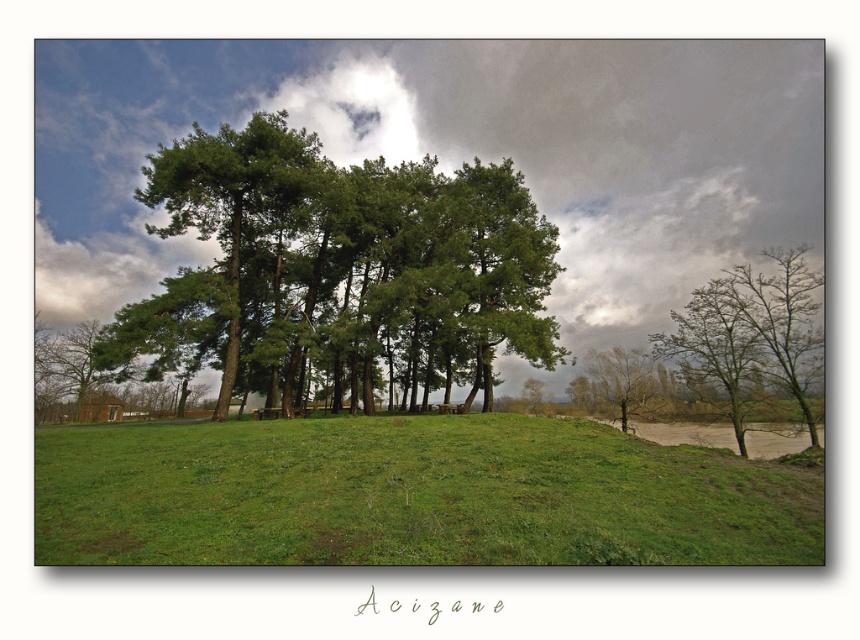
You are planning to place a small bench between the green matte tree at center and the bare branches tree at lower right. Based on their widths, which tree would require more space on either side of the bench?

The green matte tree at center might be wider than the bare branches tree at lower right, so it would require more space on either side of the bench.

You are a bird looking for a nesting spot. You see two trees in the image, the bare branches tree at right and the bare branches tree at lower right. Which tree would provide a more spacious nesting area?

The bare branches tree at right has a larger size compared to the bare branches tree at lower right, so it would provide a more spacious nesting area.